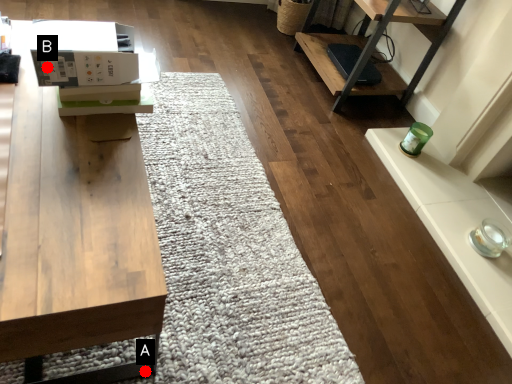
Question: Two points are circled on the image, labeled by A and B beside each circle. Among these points, which one is farthest from the camera?

Choices:
 (A) A is further
 (B) B is further

Answer: (A)